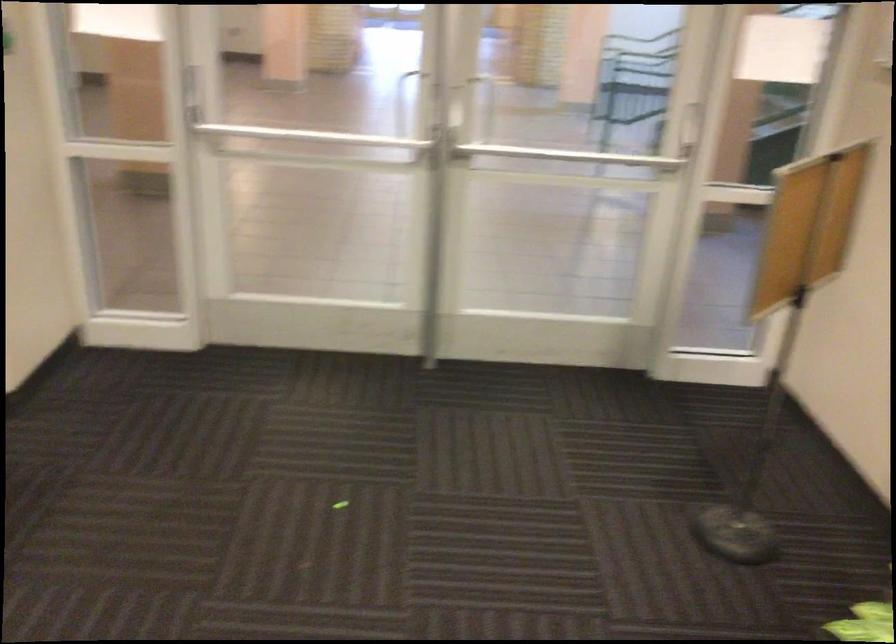
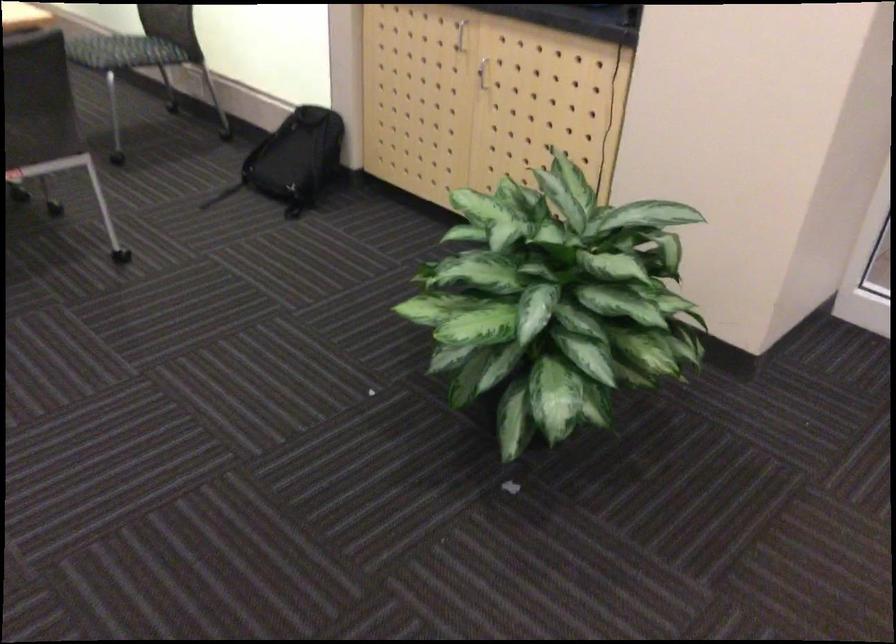
Question: The images are taken continuously from a first-person perspective. In which direction is your viewpoint rotating?

Choices:
 (A) Left
 (B) Right
 (C) Up
 (D) Down

Answer: (A)